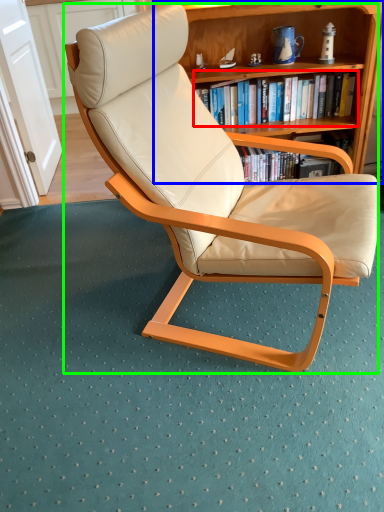
Question: Based on their relative distances, which object is nearer to book (highlighted by a red box)? Choose from bookcase (highlighted by a blue box) and chair (highlighted by a green box).

Choices:
 (A) bookcase
 (B) chair

Answer: (A)